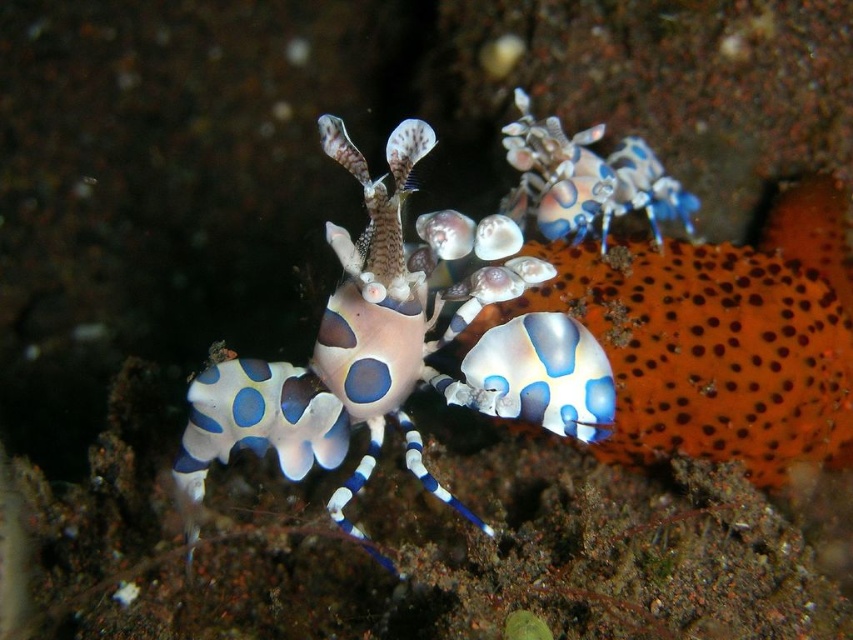
You are a marine biologist observing the underwater scene. You need to determine which shrimp is wider between the translucent blue and white spotted shrimp at center and the shiny blue and white shrimp at center. Which one is wider?

The translucent blue and white spotted shrimp at center is wider than the shiny blue and white shrimp at center according to the description.

In the scene shown: You are a marine biologist observing an underwater scene. You notice a point at coordinates [398,348]. Based on the scene, which object is this point located on?

The point at coordinates [398,348] is located on the translucent blue and white spotted shrimp at center.

You are a marine biologist studying underwater life. You observe the translucent blue and white spotted shrimp at center in the image. If you were to draw a coordinate grid over the image with the origin at the bottom left corner, what are the coordinates of the shrimp?

The coordinates of the translucent blue and white spotted shrimp at center are at point [398,348].